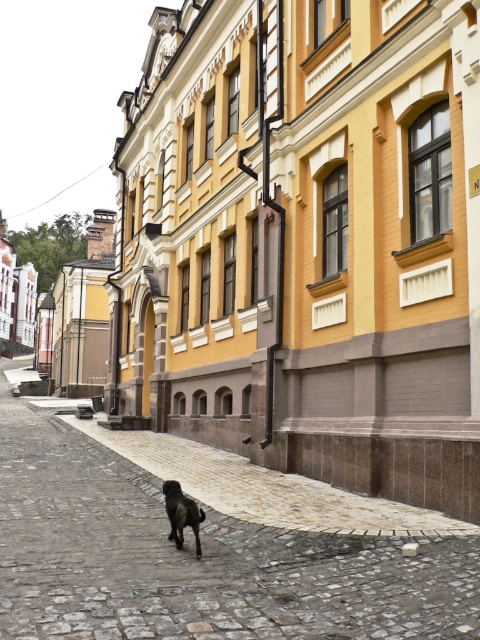
You are a tourist standing on the gray cobblestone pavement at center and want to pet the shiny black dog at center. Which direction should you move to reach the dog?

The gray cobblestone pavement at center is to the left of the shiny black dog at center, so you should move to the right to reach the dog.

You are standing on the cobblestone street in front of the historic building. There is a specific point marked at coordinates (x=194, y=557). What is located at that point?

The point at coordinates (x=194, y=557) indicates gray cobblestone pavement at center.

You are standing on the cobblestone street in front of the historic building. You see two points marked on the ground. Which point is closer to you, point (x=6, y=440) or point (x=202, y=520)?

Point (x=6, y=440) is closer to you because it is further to the viewer than point (x=202, y=520).